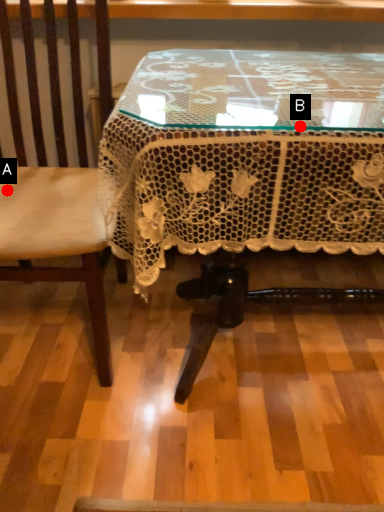
Question: Two points are circled on the image, labeled by A and B beside each circle. Which point appears farthest from the camera in this image?

Choices:
 (A) A is further
 (B) B is further

Answer: (A)